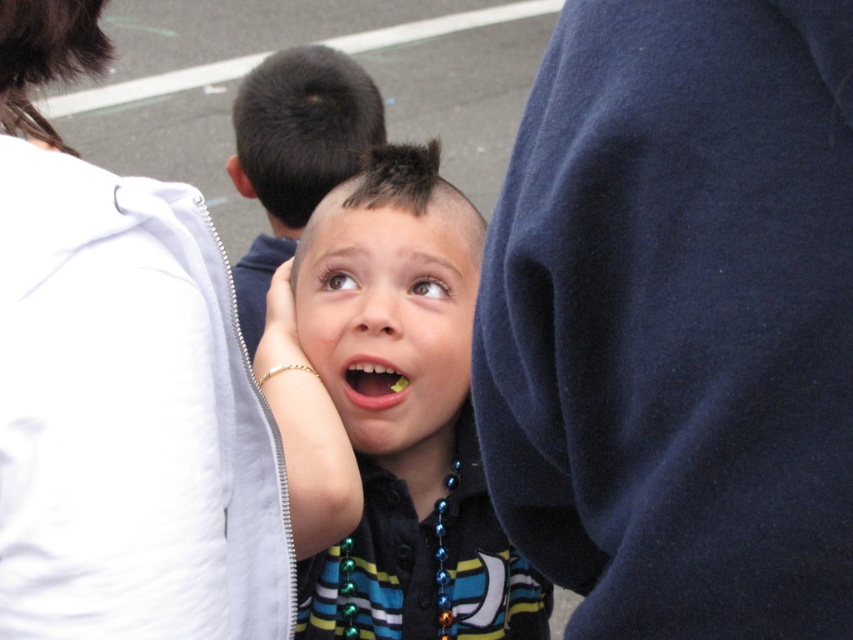
Question: Among these objects, which one is farthest from the camera?

Choices:
 (A) shiny black hair at center
 (B) striped jersey at center
 (C) dark blue fleece at center

Answer: (A)

Question: Which object is farther from the camera taking this photo?

Choices:
 (A) smooth skin face at center
 (B) dark blue fleece at center
 (C) yellow plastic teeth at center
 (D) striped jersey at center

Answer: (C)

Question: Is dark blue fleece at center to the left of striped jersey at center from the viewer's perspective?

Choices:
 (A) no
 (B) yes

Answer: (A)

Question: Does white fabric at upper left have a smaller size compared to striped jersey at center?

Choices:
 (A) no
 (B) yes

Answer: (B)

Question: Among these objects, which one is nearest to the camera?

Choices:
 (A) striped jersey at center
 (B) smooth skin face at center
 (C) shiny black hair at center

Answer: (A)

Question: Does dark blue fleece at center have a greater width compared to shiny black hair at center?

Choices:
 (A) no
 (B) yes

Answer: (A)